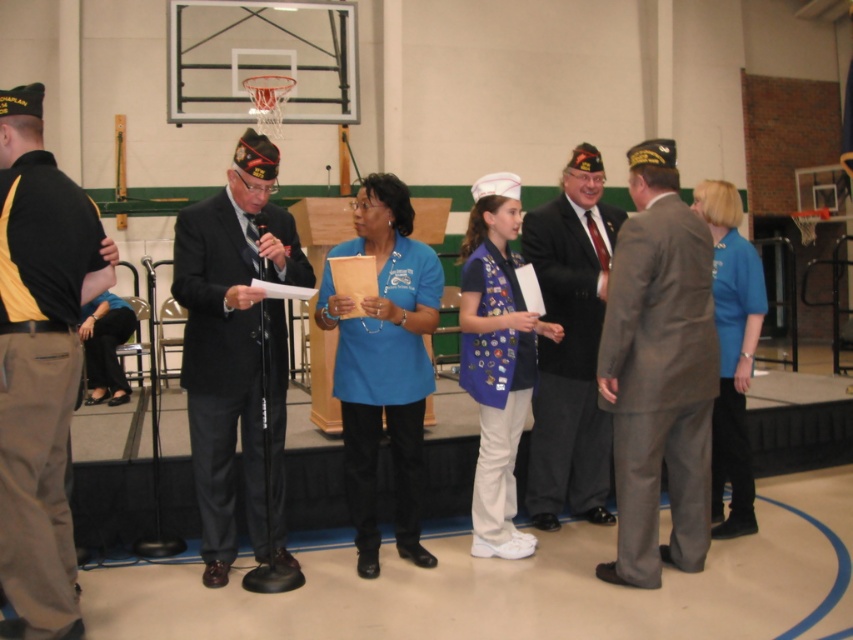
Does gray wool suit at center appear on the right side of blue fabric shirt at center?

Correct, you'll find gray wool suit at center to the right of blue fabric shirt at center.

Who is taller, gray wool suit at center or blue fabric shirt at center?

Standing taller between the two is gray wool suit at center.

Is point (618, 369) behind point (399, 296)?

No, it is in front of (399, 296).

At what (x,y) coordinates should I click in order to perform the action: click on gray wool suit at center. Please return your answer as a coordinate pair (x, y). Looking at the image, I should click on (x=659, y=372).

Which is more to the left, gray wool suit at center or dark gray suit at center?

From the viewer's perspective, dark gray suit at center appears more on the left side.

Can you confirm if gray wool suit at center is positioned above dark gray suit at center?

Actually, gray wool suit at center is below dark gray suit at center.

You are a GUI agent. You are given a task and a screenshot of the screen. Output one action in this format:
    pyautogui.click(x=<x>, y=<y>)
    Task: Click on the gray wool suit at center
    Image resolution: width=853 pixels, height=640 pixels.
    Given the screenshot: What is the action you would take?
    pyautogui.click(x=659, y=372)

Is point (489, 376) closer to viewer compared to point (721, 259)?

Yes, point (489, 376) is in front of point (721, 259).

Who is more forward, (x=514, y=486) or (x=718, y=417)?

Point (x=514, y=486) is in front.

Describe the element at coordinates (496, 358) in the screenshot. This screenshot has width=853, height=640. I see `blue fabric vest at center` at that location.

At what (x,y) coordinates should I click in order to perform the action: click on blue fabric vest at center. Please return your answer as a coordinate pair (x, y). This screenshot has height=640, width=853. Looking at the image, I should click on (496, 358).